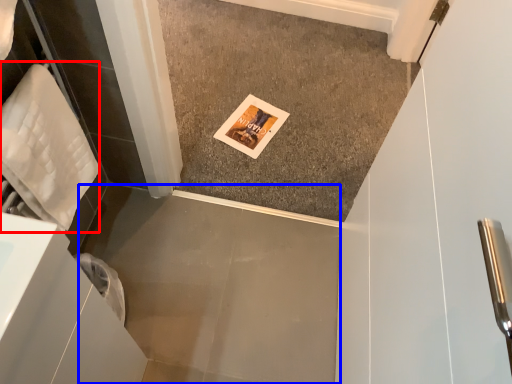
Question: Which object appears closest to the camera in this image, material (highlighted by a red box) or concrete (highlighted by a blue box)?

Choices:
 (A) material
 (B) concrete

Answer: (A)